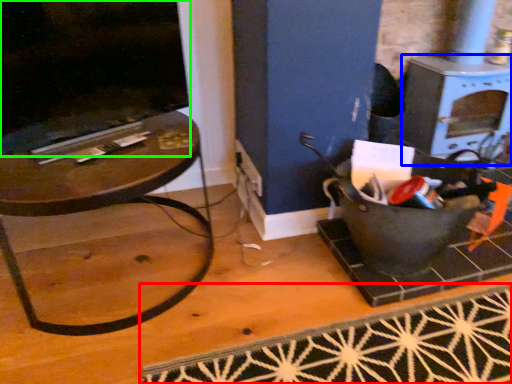
Question: Which object is the farthest from doormat (highlighted by a red box)? Choose among these: stove (highlighted by a blue box) or fireplace (highlighted by a green box).

Choices:
 (A) stove
 (B) fireplace

Answer: (B)